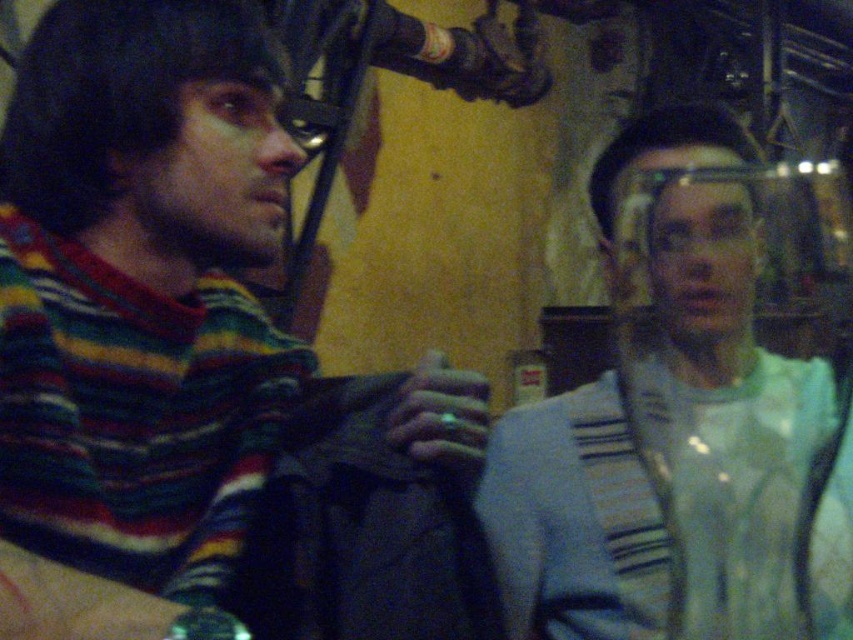
Who is positioned more to the right, striped wool sweater at left or light blue fabric at right?

light blue fabric at right

Does striped wool sweater at left appear on the left side of light blue fabric at right?

Indeed, striped wool sweater at left is positioned on the left side of light blue fabric at right.

The image size is (853, 640). Describe the element at coordinates (204, 353) in the screenshot. I see `striped wool sweater at left` at that location.

Where is `striped wool sweater at left`? striped wool sweater at left is located at coordinates (204, 353).